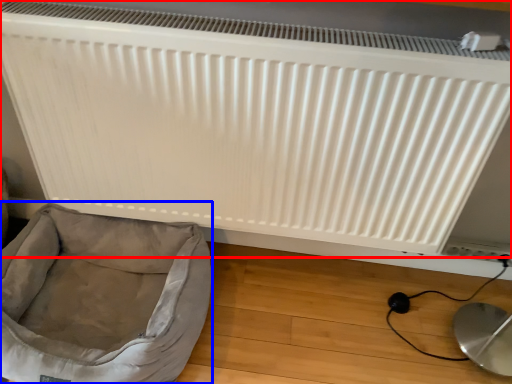
Question: Which of the following is the farthest to the observer, radiator (highlighted by a red box) or dog bed (highlighted by a blue box)?

Choices:
 (A) radiator
 (B) dog bed

Answer: (B)